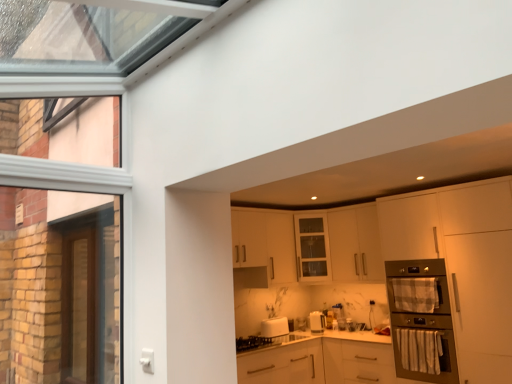
Describe the element at coordinates (79, 305) in the screenshot. I see `brown wooden screen door at left` at that location.

What do you see at coordinates (415, 294) in the screenshot?
I see `plaid fabric oven door at right` at bounding box center [415, 294].

What is the approximate width of metallic stainless steel oven at right?

It is 23.48 inches.

Where is `white matte cabinet at upper center, which is counted as the 1th cabinetry, starting from the top`? The width and height of the screenshot is (512, 384). white matte cabinet at upper center, which is counted as the 1th cabinetry, starting from the top is located at coordinates (339, 245).

The image size is (512, 384). Describe the element at coordinates (322, 361) in the screenshot. I see `white matte cabinet at lower center, the 1th cabinetry positioned from the bottom` at that location.

The width and height of the screenshot is (512, 384). What are the coordinates of `brown wooden screen door at left` in the screenshot? It's located at (79, 305).

Where is `screen door on the left of the metallic stainless steel oven at right`? The image size is (512, 384). screen door on the left of the metallic stainless steel oven at right is located at coordinates (79, 305).

Is brown wooden screen door at left facing towards metallic stainless steel oven at right?

Yes, brown wooden screen door at left is oriented towards metallic stainless steel oven at right.

Which object is closer to the camera, brown wooden screen door at left or metallic stainless steel oven at right?

Positioned in front is brown wooden screen door at left.

What's the angular difference between brown wooden screen door at left and metallic stainless steel oven at right's facing directions?

brown wooden screen door at left and metallic stainless steel oven at right are facing 180 degrees away from each other.

Considering the relative positions of white matte cabinet at lower center, the third cabinetry positioned from the top, and plaid fabric oven door at right in the image provided, is white matte cabinet at lower center, the third cabinetry positioned from the top, to the right of plaid fabric oven door at right from the viewer's perspective?

No, white matte cabinet at lower center, the third cabinetry positioned from the top, is not to the right of plaid fabric oven door at right.

Could you tell me if white matte cabinet at lower center, the 1th cabinetry positioned from the bottom, is facing plaid fabric oven door at right?

No, white matte cabinet at lower center, the 1th cabinetry positioned from the bottom, is not facing towards plaid fabric oven door at right.

The height and width of the screenshot is (384, 512). I want to click on the 2nd cabinetry directly beneath the plaid fabric oven door at right (from a real-world perspective), so 322,361.

Measure the distance between white matte cabinet at lower center, the third cabinetry positioned from the top, and plaid fabric oven door at right.

The distance of white matte cabinet at lower center, the third cabinetry positioned from the top, from plaid fabric oven door at right is 35.34 inches.

Is plaid fabric oven door at right situated inside white matte cabinet at upper center, which is counted as the 1th cabinetry, starting from the top, or outside?

plaid fabric oven door at right is located beyond the bounds of white matte cabinet at upper center, which is counted as the 1th cabinetry, starting from the top.

Is plaid fabric oven door at right taller than white matte cabinet at upper center, which is counted as the 1th cabinetry, starting from the top?

No, plaid fabric oven door at right is not taller than white matte cabinet at upper center, which is counted as the 1th cabinetry, starting from the top.

Based on their positions, is plaid fabric oven door at right located to the left or right of white matte cabinet at upper center, which is counted as the 1th cabinetry, starting from the top?

From the image, it's evident that plaid fabric oven door at right is to the right of white matte cabinet at upper center, which is counted as the 1th cabinetry, starting from the top.

Considering the relative positions of plaid fabric oven door at right and white matte cabinet at upper center, arranged as the 3th cabinetry when ordered from the bottom, in the image provided, is plaid fabric oven door at right behind white matte cabinet at upper center, arranged as the 3th cabinetry when ordered from the bottom,?

No, it is in front of white matte cabinet at upper center, arranged as the 3th cabinetry when ordered from the bottom.

Does white matte cabinet at upper center, which is counted as the 1th cabinetry, starting from the top, come behind metallic stainless steel oven at right?

Yes, white matte cabinet at upper center, which is counted as the 1th cabinetry, starting from the top, is further from the viewer.

Based on the photo, from the image's perspective, is white matte cabinet at upper center, which is counted as the 1th cabinetry, starting from the top, located above or below metallic stainless steel oven at right?

white matte cabinet at upper center, which is counted as the 1th cabinetry, starting from the top, is above metallic stainless steel oven at right.

Between white matte cabinet at upper center, arranged as the 3th cabinetry when ordered from the bottom, and metallic stainless steel oven at right, which one appears on the left side from the viewer's perspective?

Positioned to the left is white matte cabinet at upper center, arranged as the 3th cabinetry when ordered from the bottom.

Which of these two, white matte cabinet at upper center, which is counted as the 1th cabinetry, starting from the top, or metallic stainless steel oven at right, is smaller?

With smaller size is white matte cabinet at upper center, which is counted as the 1th cabinetry, starting from the top.

From a real-world perspective, between white glossy toaster at lower center and metallic stainless steel oven at right, who is vertically lower?

From a 3D spatial view, white glossy toaster at lower center is below.

Considering the relative sizes of white glossy toaster at lower center and metallic stainless steel oven at right in the image provided, is white glossy toaster at lower center wider than metallic stainless steel oven at right?

In fact, white glossy toaster at lower center might be narrower than metallic stainless steel oven at right.

From the picture: Is white glossy toaster at lower center positioned behind metallic stainless steel oven at right?

Yes, it is behind metallic stainless steel oven at right.

Locate an element on the screen. The image size is (512, 384). kitchen appliance that is on the left side of metallic stainless steel oven at right is located at coordinates (274, 327).

From the image's perspective, which is above, brown wooden screen door at left or white matte cabinet at upper center, which is counted as the 1th cabinetry, starting from the top?

From the image's view, white matte cabinet at upper center, which is counted as the 1th cabinetry, starting from the top, is above.

Would you consider brown wooden screen door at left to be distant from white matte cabinet at upper center, arranged as the 3th cabinetry when ordered from the bottom?

Yes, brown wooden screen door at left and white matte cabinet at upper center, arranged as the 3th cabinetry when ordered from the bottom, are located far from each other.

Which point is more distant from viewer, (x=84, y=266) or (x=361, y=239)?

Positioned behind is point (x=361, y=239).

In the scene shown: Does white matte cabinet at lower center, the third cabinetry positioned from the top, turn towards white matte oven at right, the second cabinetry positioned from the top?

No, white matte cabinet at lower center, the third cabinetry positioned from the top, is not aimed at white matte oven at right, the second cabinetry positioned from the top.

Is white matte cabinet at lower center, the third cabinetry positioned from the top, not within white matte oven at right, the second cabinetry positioned from the top?

Yes, white matte cabinet at lower center, the third cabinetry positioned from the top, is located beyond the bounds of white matte oven at right, the second cabinetry positioned from the top.

From the image's perspective, is white matte cabinet at lower center, the third cabinetry positioned from the top, located beneath white matte oven at right, marked as the second cabinetry in a bottom-to-top arrangement?

Indeed, from the image's perspective, white matte cabinet at lower center, the third cabinetry positioned from the top, is shown beneath white matte oven at right, marked as the second cabinetry in a bottom-to-top arrangement.

You are a GUI agent. You are given a task and a screenshot of the screen. Output one action in this format:
    pyautogui.click(x=<x>, y=<y>)
    Task: Click on the screen door lying on the left of metallic stainless steel oven at right
    The width and height of the screenshot is (512, 384).
    Given the screenshot: What is the action you would take?
    pyautogui.click(x=79, y=305)

Identify the location of material above the white matte cabinet at lower center, the 1th cabinetry positioned from the bottom (from the image's perspective). Image resolution: width=512 pixels, height=384 pixels. (415, 294).

Consider the image. From the image, which object appears to be farther from white matte cabinet at upper center, arranged as the 3th cabinetry when ordered from the bottom, white glossy toaster at lower center or white matte cabinet at lower center, the third cabinetry positioned from the top?

Based on the image, white glossy toaster at lower center appears to be further to white matte cabinet at upper center, arranged as the 3th cabinetry when ordered from the bottom.

Considering their positions, is white matte oven at right, marked as the second cabinetry in a bottom-to-top arrangement, positioned further to brown wooden screen door at left than white matte cabinet at upper center, which is counted as the 1th cabinetry, starting from the top?

white matte oven at right, marked as the second cabinetry in a bottom-to-top arrangement, lies further to brown wooden screen door at left than the other object.

Considering their positions, is metallic stainless steel oven at right positioned further to white matte oven at right, the second cabinetry positioned from the top, than plaid fabric oven door at right?

plaid fabric oven door at right is further to white matte oven at right, the second cabinetry positioned from the top.

Estimate the real-world distances between objects in this image. Which object is further from white matte cabinet at lower center, the 1th cabinetry positioned from the bottom, brown wooden screen door at left or white matte cabinet at upper center, arranged as the 3th cabinetry when ordered from the bottom?

brown wooden screen door at left is further to white matte cabinet at lower center, the 1th cabinetry positioned from the bottom.

In the scene shown: Considering their positions, is white matte cabinet at lower center, the 1th cabinetry positioned from the bottom, positioned closer to plaid fabric oven door at right than metallic stainless steel oven at right?

The object closer to plaid fabric oven door at right is metallic stainless steel oven at right.

Consider the image. Estimate the real-world distances between objects in this image. Which object is further from white matte cabinet at lower center, the third cabinetry positioned from the top, metallic stainless steel oven at right or plaid fabric oven door at right?

plaid fabric oven door at right is positioned further to the anchor white matte cabinet at lower center, the third cabinetry positioned from the top.

From the image, which object appears to be nearer to brown wooden screen door at left, metallic stainless steel oven at right or plaid fabric oven door at right?

Based on the image, plaid fabric oven door at right appears to be nearer to brown wooden screen door at left.

When comparing their distances from white matte cabinet at upper center, which is counted as the 1th cabinetry, starting from the top, does white matte oven at right, marked as the second cabinetry in a bottom-to-top arrangement, or brown wooden screen door at left seem further?

Among the two, brown wooden screen door at left is located further to white matte cabinet at upper center, which is counted as the 1th cabinetry, starting from the top.

Identify the location of kitchen appliance located between brown wooden screen door at left and metallic stainless steel oven at right in the left-right direction. This screenshot has height=384, width=512. (274, 327).

At what (x,y) coordinates should I click in order to perform the action: click on home appliance located between white matte oven at right, marked as the second cabinetry in a bottom-to-top arrangement, and plaid fabric oven door at right in the depth direction. Please return your answer as a coordinate pair (x, y). Looking at the image, I should click on (420, 313).

Find the location of a particular element. The height and width of the screenshot is (384, 512). material between brown wooden screen door at left and white matte oven at right, the second cabinetry positioned from the top, from left to right is located at coordinates (415, 294).

Where is `home appliance situated between brown wooden screen door at left and white matte oven at right, the second cabinetry positioned from the top, from left to right`? This screenshot has width=512, height=384. home appliance situated between brown wooden screen door at left and white matte oven at right, the second cabinetry positioned from the top, from left to right is located at coordinates (420, 313).